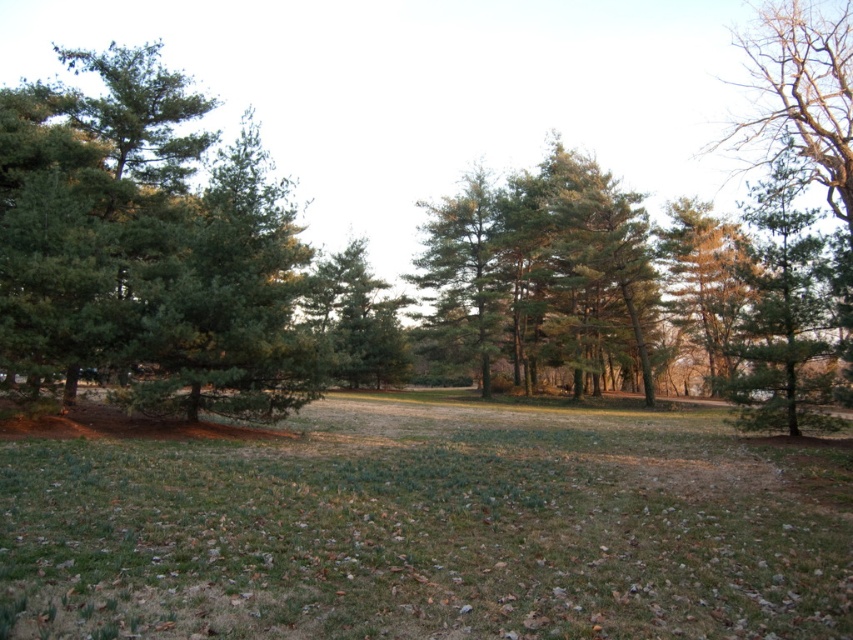
Question: Which of the following is the farthest from the observer?

Choices:
 (A) (343, 321)
 (B) (791, 262)
 (C) (19, 90)

Answer: (A)

Question: Which object is the farthest from the green matte tree at right?

Choices:
 (A) green grass at center
 (B) green needle-like tree at left

Answer: (B)

Question: Does green grass at center appear over green matte tree at center?

Choices:
 (A) no
 (B) yes

Answer: (A)

Question: Which point is closer to the camera?

Choices:
 (A) (93, 465)
 (B) (395, 381)
 (C) (76, 115)
 (D) (798, 253)

Answer: (A)

Question: Is green grass at center to the right of green matte tree at center from the viewer's perspective?

Choices:
 (A) yes
 (B) no

Answer: (A)

Question: Is green needle-like tree at left above green matte tree at right?

Choices:
 (A) no
 (B) yes

Answer: (B)